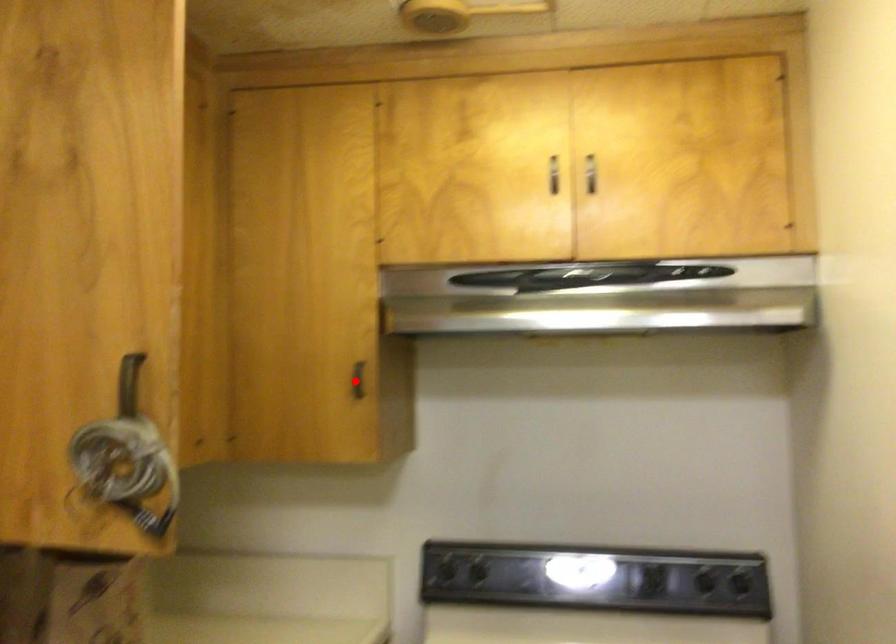
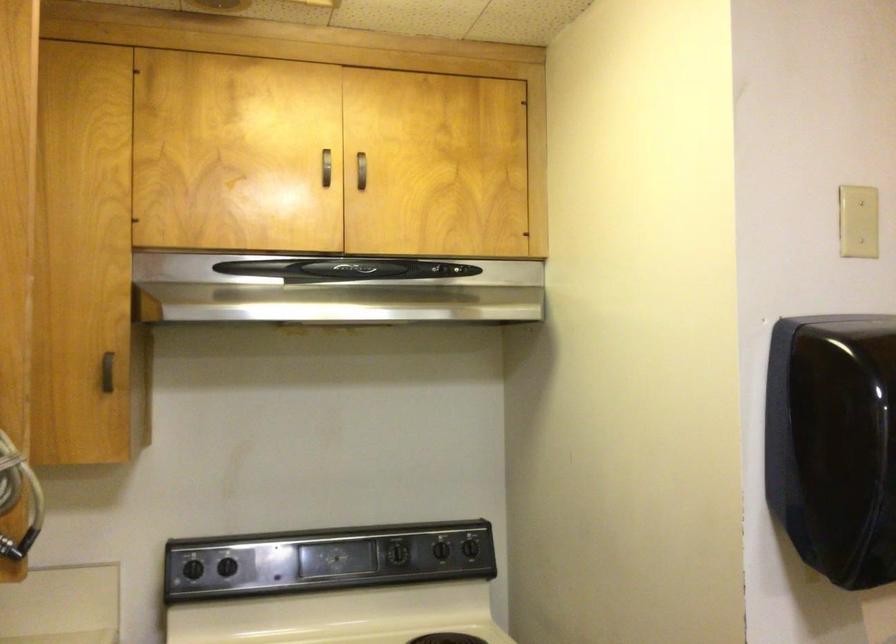
Locate, in the second image, the point that corresponds to the highlighted location in the first image.

(107, 372)